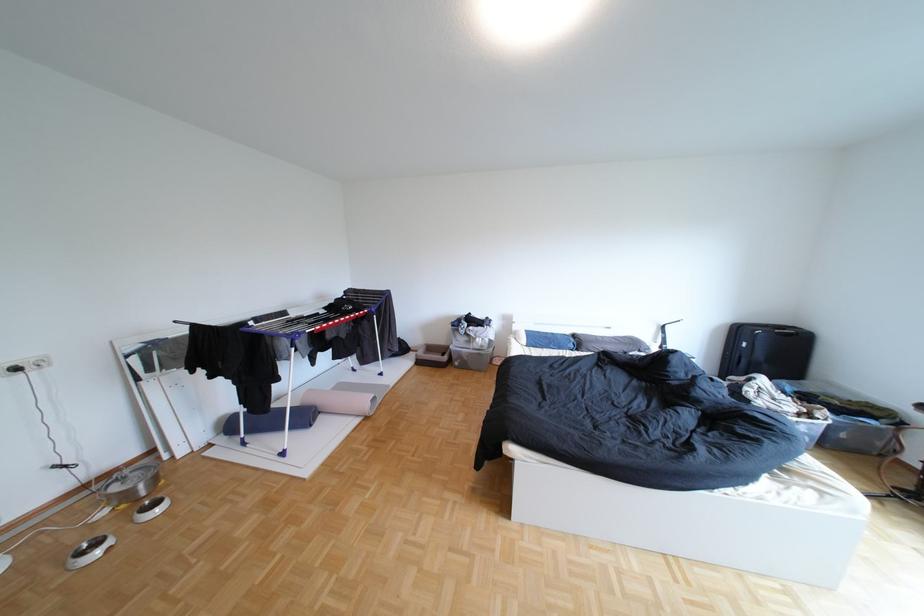
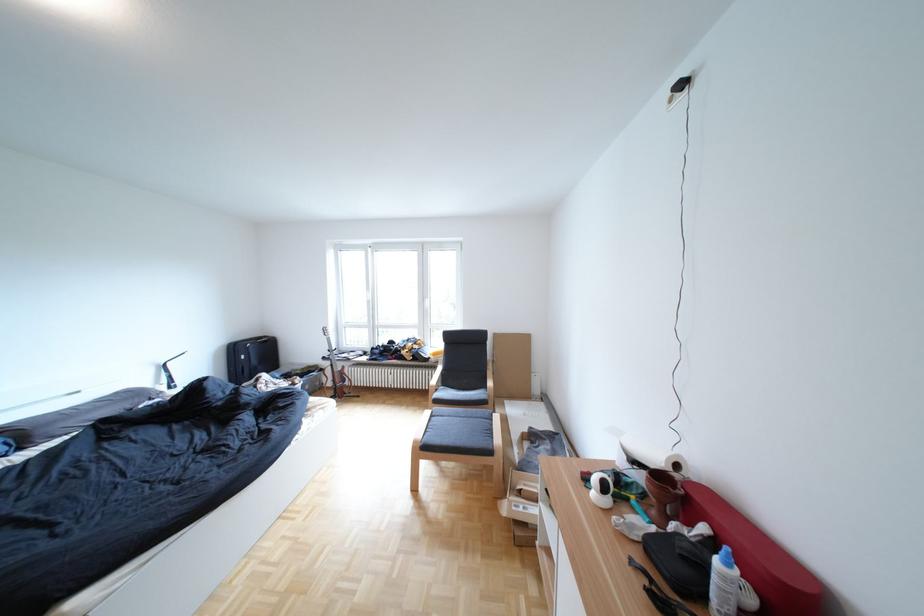
Question: The camera is either moving clockwise (left) or counter-clockwise (right) around the object. The first image is from the beginning of the video and the second image is from the end. Is the camera moving left or right when shooting the video?

Choices:
 (A) Left
 (B) Right

Answer: (A)